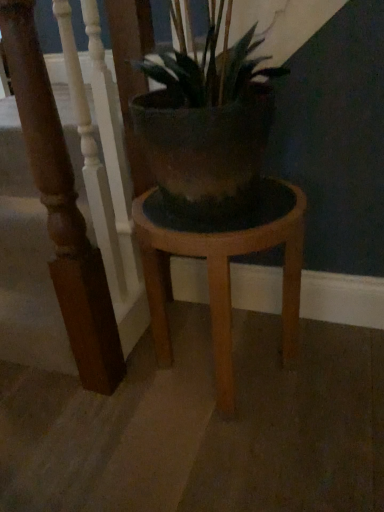
I want to click on empty space that is ontop of wooden stool at center, so click(x=218, y=209).